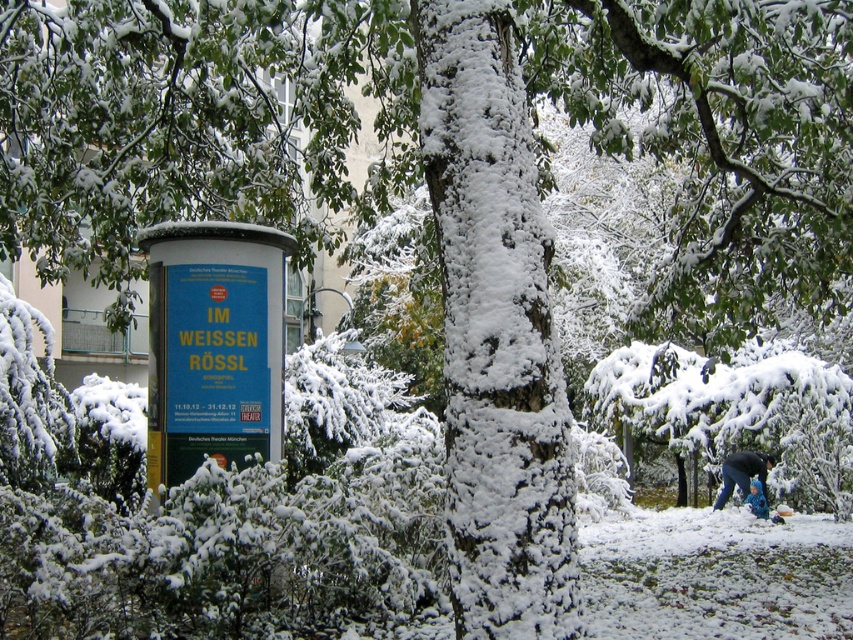
Question: Which of the following is the farthest from the observer?

Choices:
 (A) (755, 470)
 (B) (161, 310)

Answer: (A)

Question: Is blue paper at center below dark blue jacket at lower right?

Choices:
 (A) no
 (B) yes

Answer: (A)

Question: Which of these objects is positioned farthest from the blue paper at center?

Choices:
 (A) dark blue jacket at lower right
 (B) blue fuzzy coat at lower right

Answer: (A)

Question: Based on their relative distances, which object is nearer to the dark blue jacket at lower right?

Choices:
 (A) blue paper at center
 (B) blue fuzzy coat at lower right

Answer: (B)

Question: Can you confirm if blue paper at center is bigger than dark blue jacket at lower right?

Choices:
 (A) no
 (B) yes

Answer: (B)

Question: Does dark blue jacket at lower right have a lesser width compared to blue fuzzy coat at lower right?

Choices:
 (A) yes
 (B) no

Answer: (B)